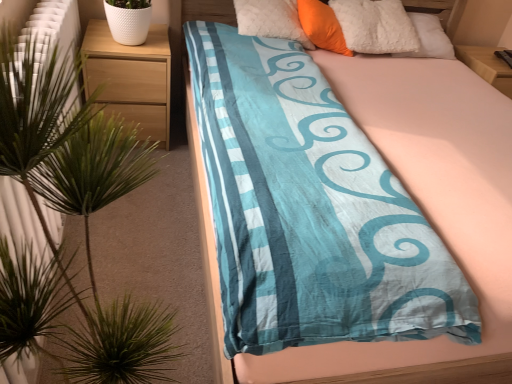
Question: Does green leafy plant at left appear on the right side of blue cotton bed at center?

Choices:
 (A) no
 (B) yes

Answer: (A)

Question: Does green leafy plant at left have a smaller size compared to blue cotton bed at center?

Choices:
 (A) no
 (B) yes

Answer: (B)

Question: From a real-world perspective, is green leafy plant at left positioned under blue cotton bed at center based on gravity?

Choices:
 (A) no
 (B) yes

Answer: (A)

Question: Is green leafy plant at left at the left side of blue cotton bed at center?

Choices:
 (A) yes
 (B) no

Answer: (A)

Question: Is green leafy plant at left shorter than blue cotton bed at center?

Choices:
 (A) no
 (B) yes

Answer: (A)

Question: Relative to wooden nightstand at left, is green leafy plant at left in front or behind?

Choices:
 (A) front
 (B) behind

Answer: (A)

Question: Is point (20, 97) positioned closer to the camera than point (90, 24)?

Choices:
 (A) farther
 (B) closer

Answer: (B)

Question: Considering the relative positions of green leafy plant at left and wooden nightstand at left in the image provided, is green leafy plant at left to the left or to the right of wooden nightstand at left?

Choices:
 (A) right
 (B) left

Answer: (A)

Question: Would you say green leafy plant at left is inside or outside wooden nightstand at left?

Choices:
 (A) inside
 (B) outside

Answer: (B)

Question: Considering the positions of point (305, 1) and point (38, 152), is point (305, 1) closer or farther from the camera than point (38, 152)?

Choices:
 (A) farther
 (B) closer

Answer: (A)

Question: From the image's perspective, relative to green leafy plant at left, is orange soft pillow at upper center above or below?

Choices:
 (A) below
 (B) above

Answer: (B)

Question: Is orange soft pillow at upper center to the left or to the right of green leafy plant at left in the image?

Choices:
 (A) right
 (B) left

Answer: (A)

Question: Which is correct: orange soft pillow at upper center is inside green leafy plant at left, or outside of it?

Choices:
 (A) outside
 (B) inside

Answer: (A)

Question: Is blue cotton bed at center in front of or behind green leafy plant at left in the image?

Choices:
 (A) front
 (B) behind

Answer: (B)

Question: Looking at the image, does blue cotton bed at center seem bigger or smaller compared to green leafy plant at left?

Choices:
 (A) small
 (B) big

Answer: (B)